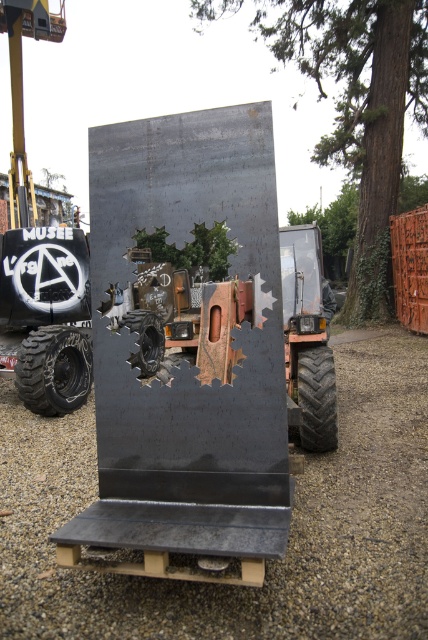
Between point (77, 397) and point (180, 362), which one is positioned behind?

The point (77, 397) is behind.

Where is `black rubber tire at lower left`? The image size is (428, 640). black rubber tire at lower left is located at coordinates (53, 369).

The height and width of the screenshot is (640, 428). In order to click on black rubber tire at lower left in this screenshot , I will do `click(53, 369)`.

Who is lower down, black rubber tractor at left or black rubber tire at lower left?

black rubber tire at lower left is lower down.

The image size is (428, 640). I want to click on black rubber tractor at left, so click(x=41, y=253).

Can you confirm if black rubber tire at lower right is shorter than rubber/soft tire at center?

No, black rubber tire at lower right is not shorter than rubber/soft tire at center.

Is black rubber tire at lower right below rubber/soft tire at center?

Yes.

Identify the location of black rubber tire at lower right. The width and height of the screenshot is (428, 640). (317, 397).